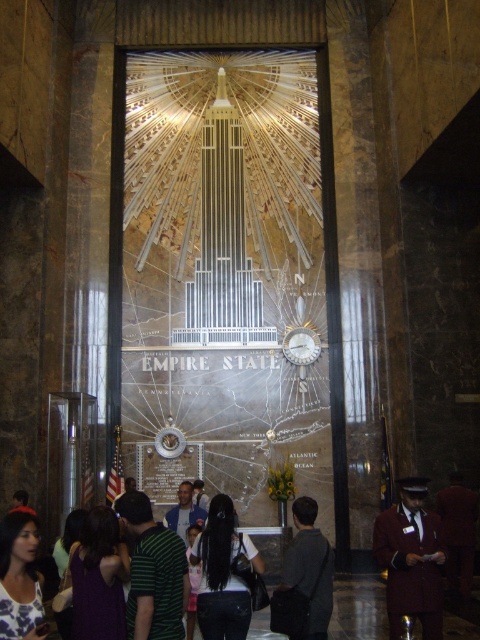
Question: Is blue fabric shirt at center further to the viewer compared to white glossy clock at center?

Choices:
 (A) yes
 (B) no

Answer: (B)

Question: Which object is closer to the camera taking this photo?

Choices:
 (A) white floral blouse at lower left
 (B) green striped shirt at center

Answer: (A)

Question: Estimate the real-world distances between objects in this image. Which object is farther from the black fabric at center?

Choices:
 (A) green striped shirt at center
 (B) white floral blouse at lower left
 (C) dark gray fabric bag at center
 (D) white glossy clock at center

Answer: (D)

Question: Which object appears farthest from the camera in this image?

Choices:
 (A) green striped shirt at center
 (B) white glossy clock at center
 (C) white floral blouse at lower left

Answer: (B)

Question: Is dark gray fabric bag at center smaller than white floral blouse at lower left?

Choices:
 (A) no
 (B) yes

Answer: (A)

Question: Does black fabric at center appear on the left side of blue fabric shirt at center?

Choices:
 (A) yes
 (B) no

Answer: (B)